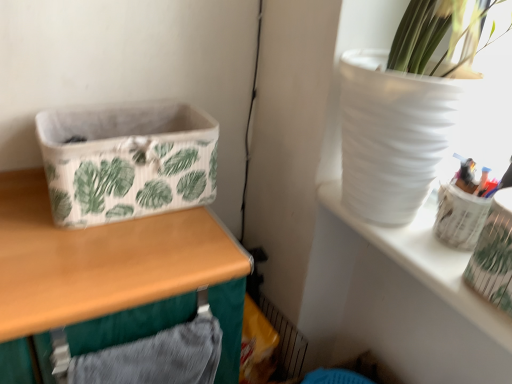
Question: Considering the relative sizes of wooden table at left and white fabric basket at left in the image provided, is wooden table at left wider than white fabric basket at left?

Choices:
 (A) no
 (B) yes

Answer: (B)

Question: Considering the relative positions of wooden table at left and white fabric basket at left in the image provided, is wooden table at left to the left of white fabric basket at left from the viewer's perspective?

Choices:
 (A) yes
 (B) no

Answer: (A)

Question: Is wooden table at left to the right of white fabric basket at left from the viewer's perspective?

Choices:
 (A) yes
 (B) no

Answer: (B)

Question: From the image's perspective, is wooden table at left under white fabric basket at left?

Choices:
 (A) yes
 (B) no

Answer: (A)

Question: From the image's perspective, is wooden table at left on top of white fabric basket at left?

Choices:
 (A) yes
 (B) no

Answer: (B)

Question: From a real-world perspective, is white fabric basket at left physically located above or below white matte vase at upper right?

Choices:
 (A) above
 (B) below

Answer: (A)

Question: Is white fabric basket at left taller or shorter than white matte vase at upper right?

Choices:
 (A) tall
 (B) short

Answer: (A)

Question: Would you say white fabric basket at left is inside or outside white matte vase at upper right?

Choices:
 (A) inside
 (B) outside

Answer: (B)

Question: Considering the positions of point (42, 130) and point (445, 281), is point (42, 130) closer or farther from the camera than point (445, 281)?

Choices:
 (A) farther
 (B) closer

Answer: (A)

Question: From a real-world perspective, relative to wooden table at left, is translucent plastic pen holder at upper right vertically above or below?

Choices:
 (A) above
 (B) below

Answer: (A)

Question: Looking at their shapes, would you say translucent plastic pen holder at upper right is wider or thinner than wooden table at left?

Choices:
 (A) wide
 (B) thin

Answer: (B)

Question: Is translucent plastic pen holder at upper right situated inside wooden table at left or outside?

Choices:
 (A) outside
 (B) inside

Answer: (A)

Question: Is point (500, 307) closer or farther from the camera than point (88, 289)?

Choices:
 (A) farther
 (B) closer

Answer: (B)

Question: Considering the positions of wooden table at left and white matte vase at upper right in the image, is wooden table at left bigger or smaller than white matte vase at upper right?

Choices:
 (A) small
 (B) big

Answer: (B)

Question: From the image's perspective, is wooden table at left above or below white matte vase at upper right?

Choices:
 (A) below
 (B) above

Answer: (A)